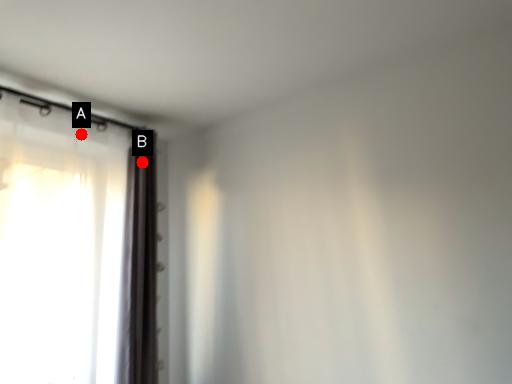
Question: Two points are circled on the image, labeled by A and B beside each circle. Which point is farther from the camera taking this photo?

Choices:
 (A) A is further
 (B) B is further

Answer: (B)